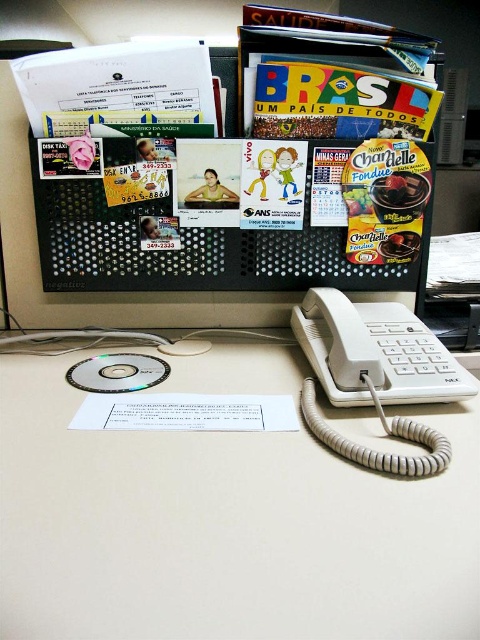
You are organizing your workspace and need to know if the white plastic desk at center can accommodate the white plastic phone at center without overlapping. Can the phone fit entirely on the desk?

The white plastic desk at center is wider than the white plastic phone at center, so the phone can fit entirely on the desk without overlapping.

You are organizing the desk and notice the white plastic phone at center and the transparent plastic cd at center. Which object is closer to you, the observer?

The white plastic phone at center is closer to you because it is positioned over the transparent plastic cd at center, indicating it is in front.

You need to place a small sticker on the white plastic desk at center and the transparent plastic cd at center. Which surface will allow the sticker to cover a larger area without overlapping?

The white plastic desk at center is wider than the transparent plastic cd at center, so the sticker can cover a larger area on the white plastic desk at center without overlapping.